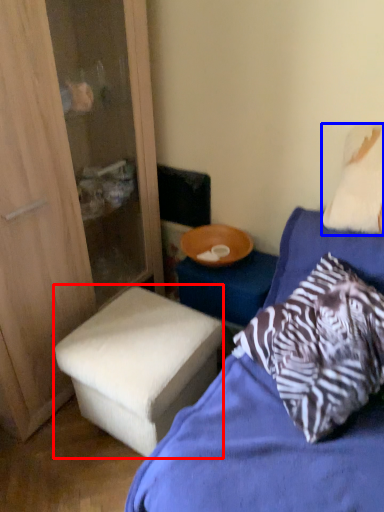
Question: Among these objects, which one is farthest to the camera, stool (highlighted by a red box) or pillow (highlighted by a blue box)?

Choices:
 (A) stool
 (B) pillow

Answer: (A)